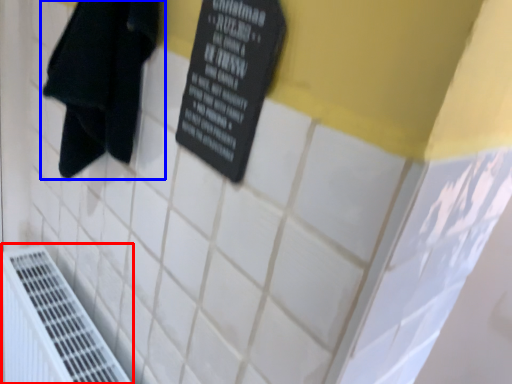
Question: Which of the following is the closest to the observer, air conditioning (highlighted by a red box) or towel (highlighted by a blue box)?

Choices:
 (A) air conditioning
 (B) towel

Answer: (B)